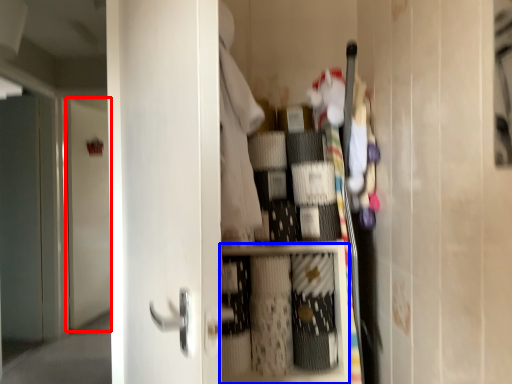
Question: Among these objects, which one is farthest to the camera, door (highlighted by a red box) or cabinet (highlighted by a blue box)?

Choices:
 (A) door
 (B) cabinet

Answer: (A)